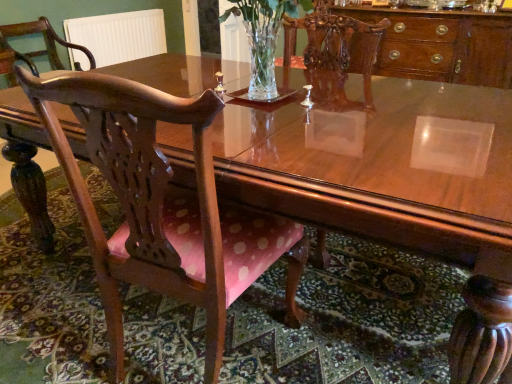
Question: Is clear glass vase at center completely or partially inside polished wood cabinet at upper right?

Choices:
 (A) yes
 (B) no

Answer: (B)

Question: Is polished wood cabinet at upper right aimed at clear glass vase at center?

Choices:
 (A) no
 (B) yes

Answer: (B)

Question: From a real-world perspective, is polished wood cabinet at upper right over clear glass vase at center?

Choices:
 (A) no
 (B) yes

Answer: (A)

Question: From a real-world perspective, is polished wood cabinet at upper right below clear glass vase at center?

Choices:
 (A) yes
 (B) no

Answer: (A)

Question: From the image's perspective, is polished wood cabinet at upper right on top of clear glass vase at center?

Choices:
 (A) yes
 (B) no

Answer: (A)

Question: From a real-world perspective, is polished wood cabinet at upper right physically located above or below polished wood chair at left, acting as the first chair starting from the back?

Choices:
 (A) above
 (B) below

Answer: (B)

Question: Is point (437, 16) closer or farther from the camera than point (74, 44)?

Choices:
 (A) farther
 (B) closer

Answer: (B)

Question: From the image's perspective, is polished wood cabinet at upper right located above or below polished wood chair at left, arranged as the 2th chair when viewed from the front?

Choices:
 (A) above
 (B) below

Answer: (B)

Question: In terms of width, does polished wood cabinet at upper right look wider or thinner when compared to polished wood chair at left, positioned as the first chair in top-to-bottom order?

Choices:
 (A) thin
 (B) wide

Answer: (B)

Question: Considering the positions of clear glass vase at center and wooden chair with pink cushion at center, which is counted as the second chair, starting from the back, in the image, is clear glass vase at center wider or thinner than wooden chair with pink cushion at center, which is counted as the second chair, starting from the back,?

Choices:
 (A) thin
 (B) wide

Answer: (A)

Question: Relative to wooden chair with pink cushion at center, which ranks as the first chair in right-to-left order, is clear glass vase at center in front or behind?

Choices:
 (A) front
 (B) behind

Answer: (B)

Question: Is clear glass vase at center inside the boundaries of wooden chair with pink cushion at center, which is the first chair from bottom to top, or outside?

Choices:
 (A) inside
 (B) outside

Answer: (B)

Question: From the image's perspective, is clear glass vase at center above or below wooden chair with pink cushion at center, acting as the first chair starting from the front?

Choices:
 (A) below
 (B) above

Answer: (B)

Question: Based on their sizes in the image, would you say wooden chair with pink cushion at center, acting as the 2th chair starting from the top, is bigger or smaller than clear glass vase at center?

Choices:
 (A) small
 (B) big

Answer: (B)

Question: Relative to clear glass vase at center, is wooden chair with pink cushion at center, acting as the 2th chair starting from the top, in front or behind?

Choices:
 (A) front
 (B) behind

Answer: (A)